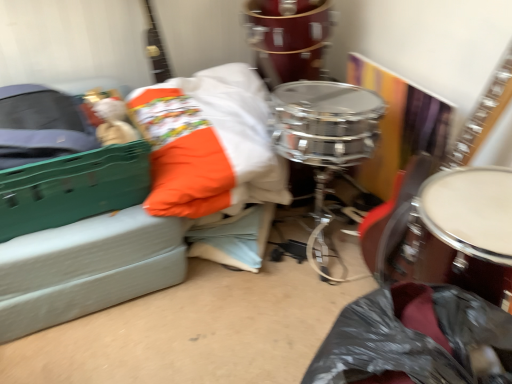
Question: Is shiny brown drum at right, acting as the 2th drum starting from the top, completely or partially inside glossy wood guitar at upper left, the 2th guitar when ordered from right to left?

Choices:
 (A) no
 (B) yes

Answer: (A)

Question: Are glossy wood guitar at upper left, acting as the 1th guitar starting from the left, and shiny brown drum at right, the 1th drum from the bottom, located far from each other?

Choices:
 (A) no
 (B) yes

Answer: (B)

Question: Does glossy wood guitar at upper left, the 2th guitar when ordered from right to left, have a lesser width compared to shiny brown drum at right, the 1th drum from the bottom?

Choices:
 (A) no
 (B) yes

Answer: (B)

Question: Is the depth of glossy wood guitar at upper left, the 2th guitar when ordered from right to left, greater than that of shiny brown drum at right, acting as the 2th drum starting from the top?

Choices:
 (A) no
 (B) yes

Answer: (B)

Question: Can you confirm if glossy wood guitar at upper left, the 2th guitar when ordered from right to left, is positioned to the right of shiny brown drum at right, acting as the 2th drum starting from the top?

Choices:
 (A) yes
 (B) no

Answer: (B)

Question: Considering the relative positions of glossy wood guitar at upper left, the 2th guitar when ordered from right to left, and shiny brown drum at right, placed as the 1th drum when sorted from front to back, in the image provided, is glossy wood guitar at upper left, the 2th guitar when ordered from right to left, in front of shiny brown drum at right, placed as the 1th drum when sorted from front to back,?

Choices:
 (A) yes
 (B) no

Answer: (B)

Question: From a real-world perspective, is shiny brown drum at right, placed as the 1th drum when sorted from front to back, positioned over wooden acoustic guitar at center right, which is counted as the 1th guitar, starting from the right, based on gravity?

Choices:
 (A) yes
 (B) no

Answer: (A)

Question: Is shiny brown drum at right, the 1th drum from the bottom, oriented away from wooden acoustic guitar at center right, the 2th guitar positioned from the left?

Choices:
 (A) no
 (B) yes

Answer: (A)

Question: Is shiny brown drum at right, the 2th drum viewed from the back, positioned in front of wooden acoustic guitar at center right, which is counted as the 1th guitar, starting from the right?

Choices:
 (A) no
 (B) yes

Answer: (B)

Question: Considering the relative sizes of shiny brown drum at right, the 1th drum from the bottom, and wooden acoustic guitar at center right, which is counted as the 1th guitar, starting from the right, in the image provided, is shiny brown drum at right, the 1th drum from the bottom, bigger than wooden acoustic guitar at center right, which is counted as the 1th guitar, starting from the right,?

Choices:
 (A) yes
 (B) no

Answer: (A)

Question: Can we say shiny brown drum at right, the 1th drum from the bottom, lies outside wooden acoustic guitar at center right, the 2th guitar positioned from the left?

Choices:
 (A) no
 (B) yes

Answer: (B)

Question: Are shiny brown drum at right, placed as the 1th drum when sorted from front to back, and wooden acoustic guitar at center right, the 2th guitar positioned from the left, located far from each other?

Choices:
 (A) yes
 (B) no

Answer: (B)

Question: Is shiny chrome drum at center, which is the first drum in top-to-bottom order, touching wooden acoustic guitar at center right, which is counted as the 1th guitar, starting from the right?

Choices:
 (A) yes
 (B) no

Answer: (B)